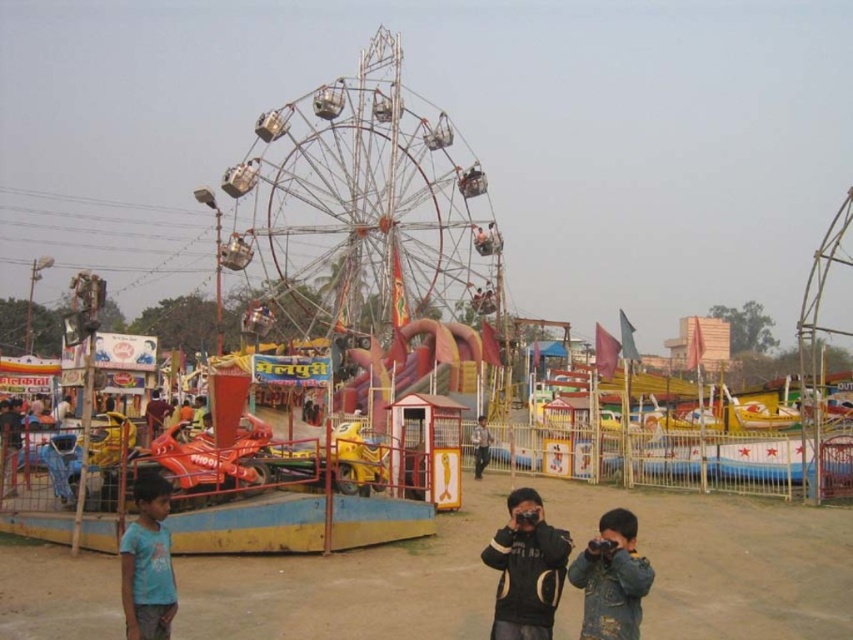
From the picture: You are a visitor at the fair and want to take a photo of the metallic ferris wheel at center without any obstructions. You notice the blue cotton shirt at lower left is in the way. Based on their heights, can you stand on the ground and still capture the entire ferris wheel in your photo?

The metallic ferris wheel at center is taller than the blue cotton shirt at lower left, so if you stand at a sufficient distance, you can angle your camera upwards to capture the entire ferris wheel while positioning yourself so the blue cotton shirt at lower left doesn

Consider the image. You are standing at the fairground and want to take a photo of the metallic ferris wheel at center and the blue cotton shirt at lower left. Which object should you focus on first to ensure it appears sharp in your photo?

You should focus on the metallic ferris wheel at center first because it is closer to you than the blue cotton shirt at lower left, so it will appear sharper when focused on first.